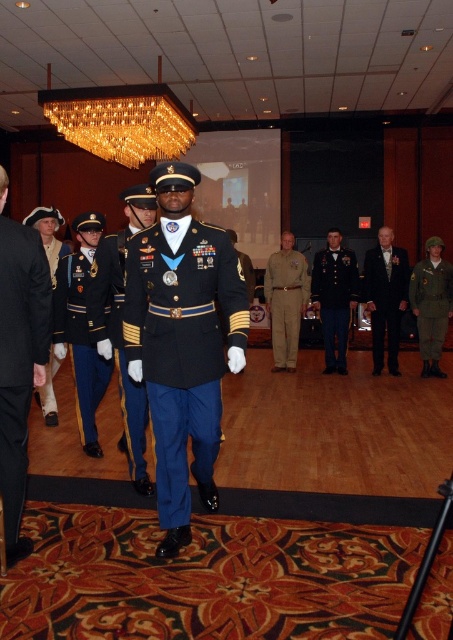
The height and width of the screenshot is (640, 453). What are the coordinates of `shiny blue uniform at center` in the screenshot? It's located at (80, 340).

The height and width of the screenshot is (640, 453). Find the location of `shiny blue uniform at center`. shiny blue uniform at center is located at coordinates (80, 340).

Who is more forward, (169, 337) or (433, 268)?

Point (169, 337) is more forward.

Who is taller, shiny black fabric uniform at center or green matte uniform at right?

shiny black fabric uniform at center

Does point (196, 417) come behind point (434, 337)?

That is False.

I want to click on shiny black fabric uniform at center, so click(183, 346).

Who is more distant from viewer, (81,417) or (341,300)?

The point (341,300) is behind.

Is point (76, 342) farther from camera compared to point (329, 365)?

No, it is not.

This screenshot has height=640, width=453. In order to click on shiny blue uniform at center in this screenshot , I will do `click(80, 340)`.